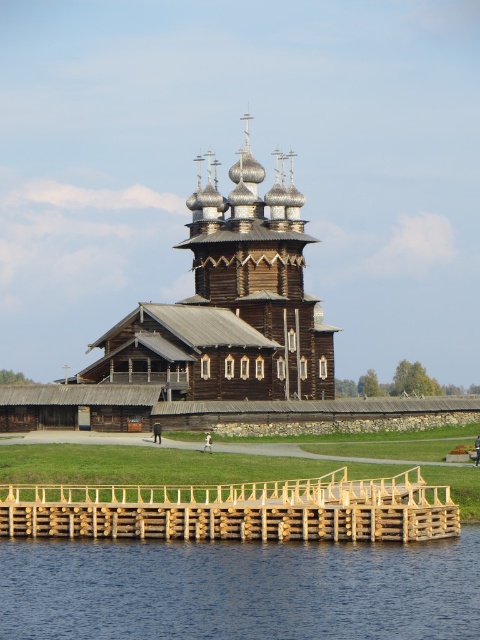
Question: Can you confirm if transparent water at lower center is thinner than wooden church at center?

Choices:
 (A) yes
 (B) no

Answer: (B)

Question: Is transparent water at lower center wider than wooden church at center?

Choices:
 (A) yes
 (B) no

Answer: (A)

Question: Can you confirm if transparent water at lower center is smaller than wooden church at center?

Choices:
 (A) yes
 (B) no

Answer: (A)

Question: Among these points, which one is farthest from the camera?

Choices:
 (A) (362, 589)
 (B) (226, 381)

Answer: (B)

Question: Which point appears closest to the camera in this image?

Choices:
 (A) (147, 605)
 (B) (170, 308)

Answer: (A)